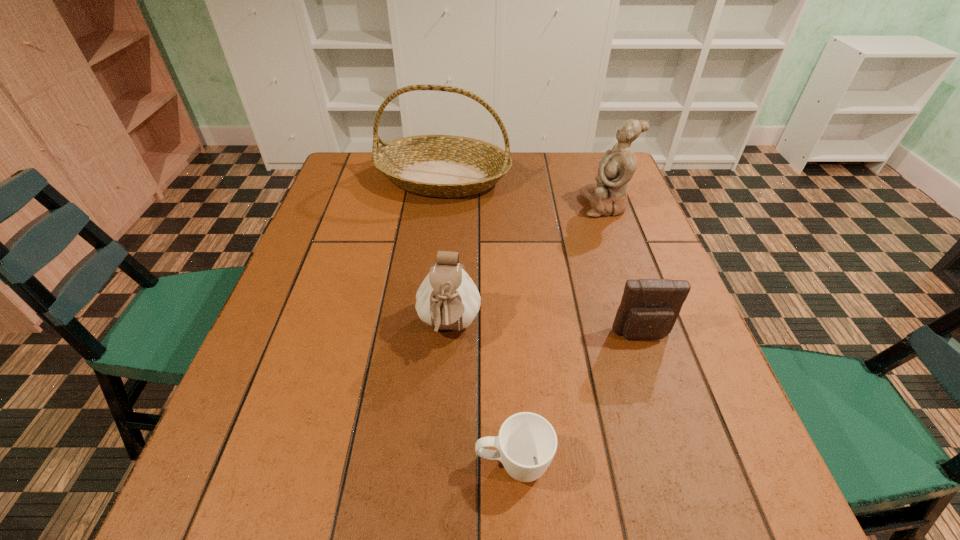
The image size is (960, 540). In order to click on blank area located on the front-facing side of the figurine in this screenshot , I will do `click(561, 205)`.

Find the location of `vacant area situated on the front-facing side of the figurine`. vacant area situated on the front-facing side of the figurine is located at coordinates (547, 205).

In order to click on vacant region located 0.270m on the front-facing side of the left pouch in this screenshot , I will do tap(438, 502).

This screenshot has height=540, width=960. What are the coordinates of `vacant region located with an open flap on the shorter pouch` in the screenshot? It's located at (667, 411).

This screenshot has height=540, width=960. What are the coordinates of `vacant position located with the handle on the side of the cup` in the screenshot? It's located at (232, 464).

The width and height of the screenshot is (960, 540). Find the location of `free point located with the handle on the side of the cup`. free point located with the handle on the side of the cup is located at coordinates (384, 464).

Where is `free location located with the handle on the side of the cup`? The width and height of the screenshot is (960, 540). free location located with the handle on the side of the cup is located at coordinates (317, 464).

Find the location of a particular element. The width and height of the screenshot is (960, 540). basket positioned at the far edge is located at coordinates (445, 166).

The image size is (960, 540). In order to click on figurine positioned at the far edge in this screenshot , I will do `click(608, 196)`.

Locate an element on the screen. This screenshot has height=540, width=960. object situated at the near edge is located at coordinates (527, 442).